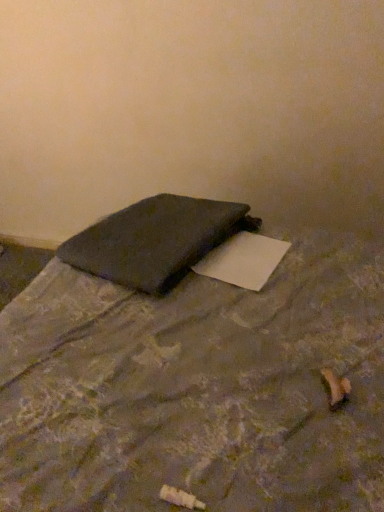
Where is `matte black bag at center`? The image size is (384, 512). matte black bag at center is located at coordinates (196, 389).

Describe the element at coordinates (196, 389) in the screenshot. The width and height of the screenshot is (384, 512). I see `matte black bag at center` at that location.

At what (x,y) coordinates should I click in order to perform the action: click on matte black bag at center. Please return your answer as a coordinate pair (x, y). This screenshot has width=384, height=512. Looking at the image, I should click on (196, 389).